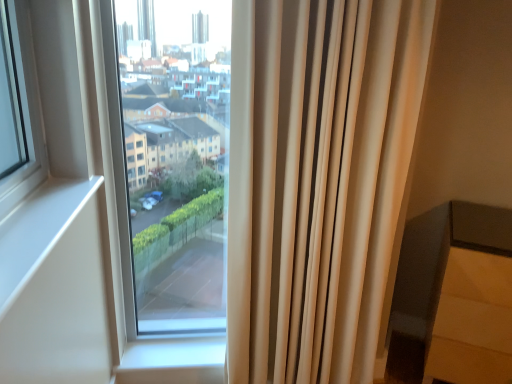
Question: From the image's perspective, would you say matte gray chair at lower right is shown under beige fabric curtain at right?

Choices:
 (A) yes
 (B) no

Answer: (A)

Question: Is matte gray chair at lower right positioned beyond the bounds of beige fabric curtain at right?

Choices:
 (A) yes
 (B) no

Answer: (A)

Question: Is the depth of matte gray chair at lower right greater than that of beige fabric curtain at right?

Choices:
 (A) no
 (B) yes

Answer: (B)

Question: Is matte gray chair at lower right turned away from beige fabric curtain at right?

Choices:
 (A) yes
 (B) no

Answer: (B)

Question: Is matte gray chair at lower right to the right of beige fabric curtain at right from the viewer's perspective?

Choices:
 (A) yes
 (B) no

Answer: (A)

Question: From a real-world perspective, is transparent glass window at center physically located above or below beige fabric curtain at right?

Choices:
 (A) above
 (B) below

Answer: (A)

Question: Is transparent glass window at center situated inside beige fabric curtain at right or outside?

Choices:
 (A) outside
 (B) inside

Answer: (A)

Question: Considering the positions of transparent glass window at center and beige fabric curtain at right in the image, is transparent glass window at center bigger or smaller than beige fabric curtain at right?

Choices:
 (A) big
 (B) small

Answer: (A)

Question: Is transparent glass window at center wider or thinner than beige fabric curtain at right?

Choices:
 (A) wide
 (B) thin

Answer: (B)

Question: Is point (288, 16) positioned closer to the camera than point (206, 321)?

Choices:
 (A) farther
 (B) closer

Answer: (B)

Question: Considering the positions of beige fabric curtain at right and transparent glass window at center in the image, is beige fabric curtain at right taller or shorter than transparent glass window at center?

Choices:
 (A) short
 (B) tall

Answer: (B)

Question: From a real-world perspective, is beige fabric curtain at right above or below transparent glass window at center?

Choices:
 (A) above
 (B) below

Answer: (B)

Question: Is beige fabric curtain at right inside or outside of transparent glass window at center?

Choices:
 (A) inside
 (B) outside

Answer: (B)

Question: From a real-world perspective, is matte gray chair at lower right above or below beige fabric curtain at right?

Choices:
 (A) below
 (B) above

Answer: (A)

Question: In terms of width, does matte gray chair at lower right look wider or thinner when compared to beige fabric curtain at right?

Choices:
 (A) thin
 (B) wide

Answer: (B)